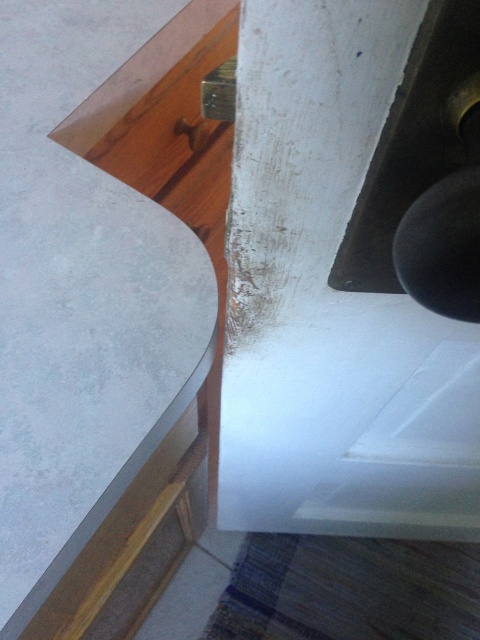
Question: Is matte concrete countertop at center positioned before matte wood drawer at lower left?

Choices:
 (A) yes
 (B) no

Answer: (A)

Question: Is matte concrete countertop at center smaller than matte wood drawer at lower left?

Choices:
 (A) yes
 (B) no

Answer: (A)

Question: Which point appears closest to the camera in this image?

Choices:
 (A) (208, 364)
 (B) (36, 612)

Answer: (B)

Question: Which object appears closest to the camera in this image?

Choices:
 (A) matte concrete countertop at center
 (B) matte wood drawer at lower left

Answer: (A)

Question: Does matte concrete countertop at center lie behind matte wood drawer at lower left?

Choices:
 (A) no
 (B) yes

Answer: (A)

Question: Among these objects, which one is nearest to the camera?

Choices:
 (A) matte wood drawer at lower left
 (B) matte concrete countertop at center

Answer: (B)